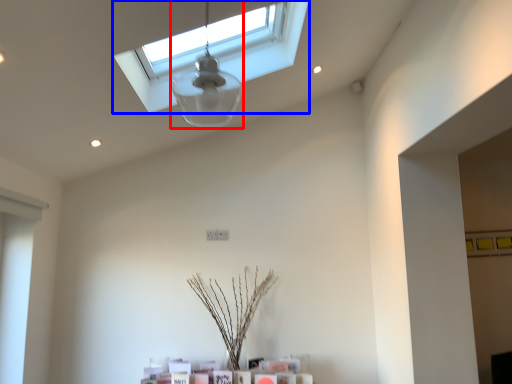
Question: Which object is further to the camera taking this photo, lamp (highlighted by a red box) or window (highlighted by a blue box)?

Choices:
 (A) lamp
 (B) window

Answer: (B)